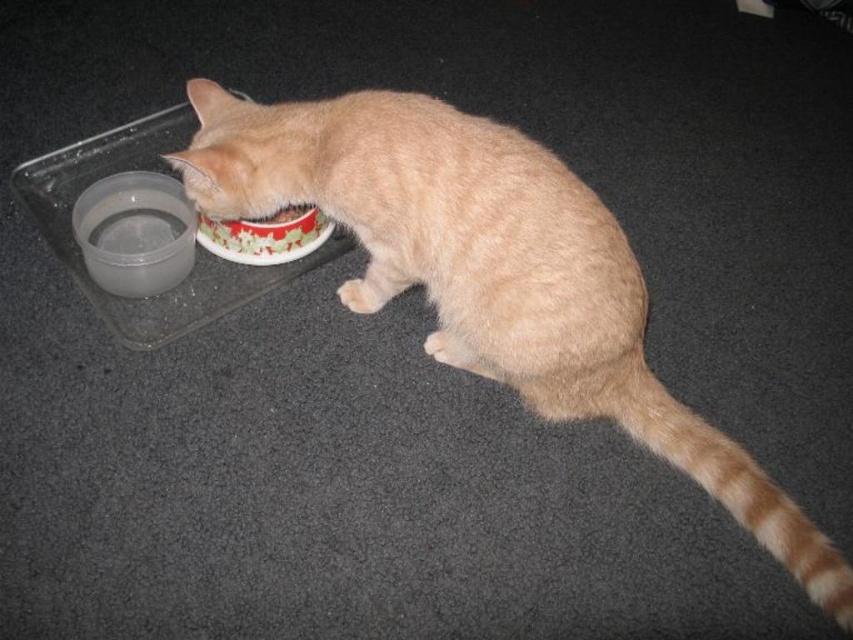
Question: Is light brown fur cat at center positioned behind red glossy bowl at center?

Choices:
 (A) no
 (B) yes

Answer: (A)

Question: Which point appears closest to the camera in this image?

Choices:
 (A) (281, 224)
 (B) (103, 200)

Answer: (A)

Question: Can you confirm if transparent plastic bowl at lower left is smaller than red glossy bowl at center?

Choices:
 (A) no
 (B) yes

Answer: (A)

Question: Is light brown fur cat at center smaller than transparent plastic bowl at lower left?

Choices:
 (A) no
 (B) yes

Answer: (A)

Question: Which object is farther from the camera taking this photo?

Choices:
 (A) light brown fur cat at center
 (B) transparent plastic bowl at lower left

Answer: (B)

Question: Estimate the real-world distances between objects in this image. Which object is closer to the light brown fur cat at center?

Choices:
 (A) red glossy bowl at center
 (B) transparent plastic bowl at lower left

Answer: (A)